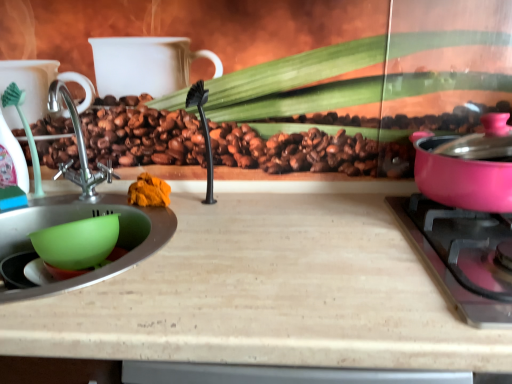
Question: Is wooden cutting board at center far away from pink glossy pot at right?

Choices:
 (A) yes
 (B) no

Answer: (B)

Question: Is wooden cutting board at center facing towards pink glossy pot at right?

Choices:
 (A) no
 (B) yes

Answer: (A)

Question: Does wooden cutting board at center have a greater height compared to pink glossy pot at right?

Choices:
 (A) no
 (B) yes

Answer: (B)

Question: Is pink glossy pot at right at the back of wooden cutting board at center?

Choices:
 (A) yes
 (B) no

Answer: (B)

Question: From a real-world perspective, is wooden cutting board at center physically below pink glossy pot at right?

Choices:
 (A) no
 (B) yes

Answer: (B)

Question: Considering their positions, is pink glossy pot at right located in front of or behind pink glossy pot at right?

Choices:
 (A) front
 (B) behind

Answer: (A)

Question: Based on their sizes in the image, would you say pink glossy pot at right is bigger or smaller than pink glossy pot at right?

Choices:
 (A) big
 (B) small

Answer: (B)

Question: In terms of height, does pink glossy pot at right look taller or shorter compared to pink glossy pot at right?

Choices:
 (A) tall
 (B) short

Answer: (B)

Question: Which is correct: pink glossy pot at right is inside pink glossy pot at right, or outside of it?

Choices:
 (A) outside
 (B) inside

Answer: (A)

Question: Is point (342, 365) positioned closer to the camera than point (437, 273)?

Choices:
 (A) farther
 (B) closer

Answer: (B)

Question: Is wooden cutting board at center taller or shorter than pink glossy pot at right?

Choices:
 (A) short
 (B) tall

Answer: (B)

Question: Based on their sizes in the image, would you say wooden cutting board at center is bigger or smaller than pink glossy pot at right?

Choices:
 (A) small
 (B) big

Answer: (B)

Question: Would you say wooden cutting board at center is to the left or to the right of pink glossy pot at right in the picture?

Choices:
 (A) right
 (B) left

Answer: (B)

Question: In the image, is green plastic mixing bowl at lower left positioned in front of or behind pink glossy pot at right?

Choices:
 (A) behind
 (B) front

Answer: (A)

Question: Based on their sizes in the image, would you say green plastic mixing bowl at lower left is bigger or smaller than pink glossy pot at right?

Choices:
 (A) small
 (B) big

Answer: (A)